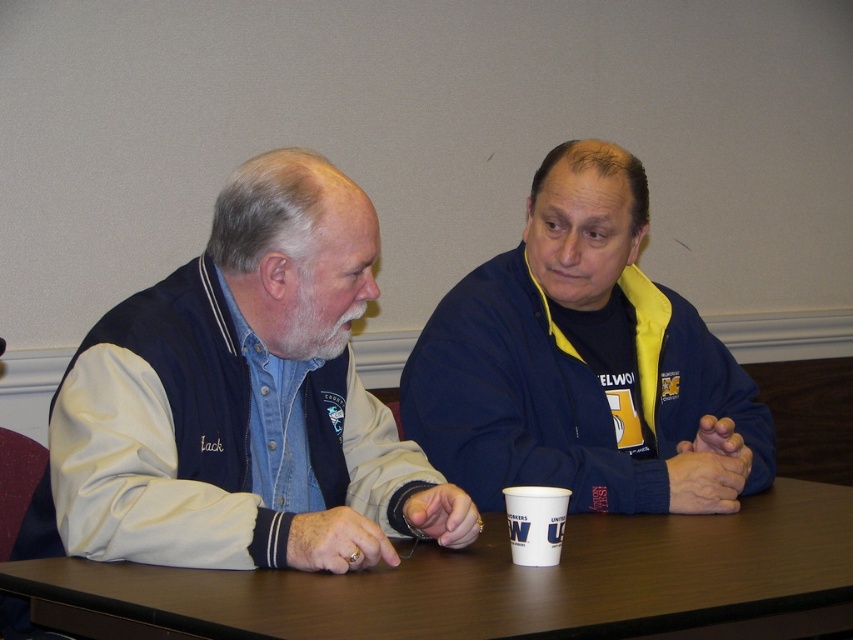
Question: Estimate the real-world distances between objects in this image. Which object is closer to the white paper cup at center?

Choices:
 (A) brown wooden table at center
 (B) navy blue jacket at center
 (C) denim jacket at left

Answer: (A)

Question: Does navy blue jacket at center have a lesser width compared to brown wooden table at center?

Choices:
 (A) yes
 (B) no

Answer: (A)

Question: Which point appears closest to the camera in this image?

Choices:
 (A) (543, 534)
 (B) (364, 604)

Answer: (B)

Question: Does denim jacket at left have a larger size compared to white paper cup at center?

Choices:
 (A) yes
 (B) no

Answer: (A)

Question: Which of these objects is positioned farthest from the brown wooden table at center?

Choices:
 (A) white paper cup at center
 (B) denim jacket at left
 (C) navy blue jacket at center

Answer: (C)

Question: Does denim jacket at left have a smaller size compared to brown wooden table at center?

Choices:
 (A) no
 (B) yes

Answer: (A)